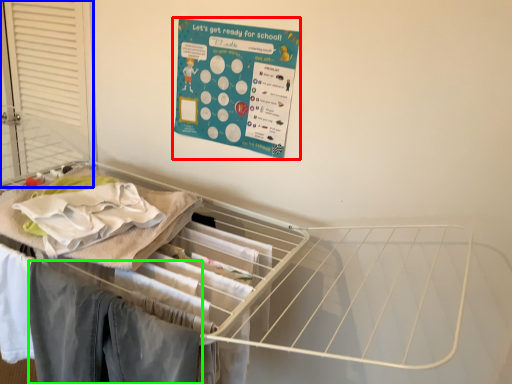
Question: Estimate the real-world distances between objects in this image. Which object is farther from poster (highlighted by a red box), screen door (highlighted by a blue box) or clothing (highlighted by a green box)?

Choices:
 (A) screen door
 (B) clothing

Answer: (B)